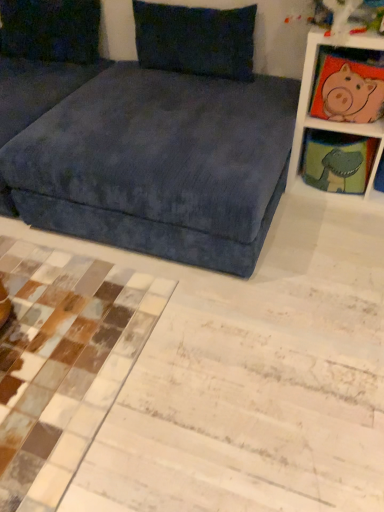
Question: Is velvety dark blue pillow at upper center, marked as the 2th pillow in a left-to-right arrangement, at the back of velvet blue studio couch at upper center?

Choices:
 (A) no
 (B) yes

Answer: (A)

Question: Does velvet blue studio couch at upper center have a greater width compared to velvety dark blue pillow at upper center, the first pillow from the right?

Choices:
 (A) yes
 (B) no

Answer: (A)

Question: Is velvet blue studio couch at upper center thinner than velvety dark blue pillow at upper center, marked as the 2th pillow in a left-to-right arrangement?

Choices:
 (A) no
 (B) yes

Answer: (A)

Question: Does velvet blue studio couch at upper center have a larger size compared to velvety dark blue pillow at upper center, marked as the 2th pillow in a left-to-right arrangement?

Choices:
 (A) yes
 (B) no

Answer: (A)

Question: Can you confirm if velvet blue studio couch at upper center is positioned to the right of velvety dark blue pillow at upper center, marked as the 2th pillow in a left-to-right arrangement?

Choices:
 (A) yes
 (B) no

Answer: (B)

Question: Is matte green fabric at upper right, which is counted as the second shelf, starting from the top, wider or thinner than pink fabric pig at upper right?

Choices:
 (A) thin
 (B) wide

Answer: (B)

Question: Do you think matte green fabric at upper right, acting as the first shelf starting from the bottom, is within pink fabric pig at upper right, or outside of it?

Choices:
 (A) outside
 (B) inside

Answer: (A)

Question: Relative to pink fabric pig at upper right, is matte green fabric at upper right, acting as the first shelf starting from the bottom, in front or behind?

Choices:
 (A) front
 (B) behind

Answer: (B)

Question: From the image's perspective, is matte green fabric at upper right, which is counted as the second shelf, starting from the top, located above or below pink fabric pig at upper right?

Choices:
 (A) below
 (B) above

Answer: (A)

Question: From the image's perspective, is matte green fabric at upper right, acting as the first shelf starting from the bottom, above or below velvety dark blue pillow at upper center, marked as the 2th pillow in a left-to-right arrangement?

Choices:
 (A) below
 (B) above

Answer: (A)

Question: Is matte green fabric at upper right, which is counted as the second shelf, starting from the top, in front of or behind velvety dark blue pillow at upper center, marked as the 2th pillow in a left-to-right arrangement, in the image?

Choices:
 (A) front
 (B) behind

Answer: (B)

Question: From a real-world perspective, relative to velvety dark blue pillow at upper center, the first pillow from the right, is matte green fabric at upper right, acting as the first shelf starting from the bottom, vertically above or below?

Choices:
 (A) above
 (B) below

Answer: (B)

Question: From their relative heights in the image, would you say matte green fabric at upper right, which is counted as the second shelf, starting from the top, is taller or shorter than velvety dark blue pillow at upper center, marked as the 2th pillow in a left-to-right arrangement?

Choices:
 (A) tall
 (B) short

Answer: (B)

Question: Is velvet blue studio couch at upper center in front of or behind white wood shelf at upper right, placed as the first shelf when sorted from top to bottom, in the image?

Choices:
 (A) behind
 (B) front

Answer: (B)

Question: In terms of height, does velvet blue studio couch at upper center look taller or shorter compared to white wood shelf at upper right, placed as the first shelf when sorted from top to bottom?

Choices:
 (A) short
 (B) tall

Answer: (B)